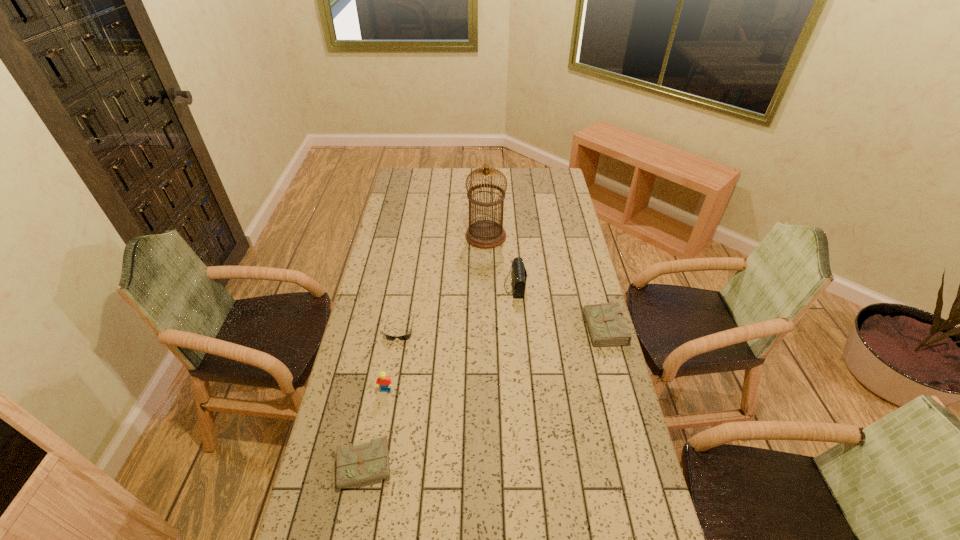
Please determine a free point for an extra diary to ensure balance. Please provide its 2D coordinates. Your answer should be formatted as a tuple, i.e. [(x, y)], where the tuple contains the x and y coordinates of a point satisfying the conditions above.

[(503, 392)]